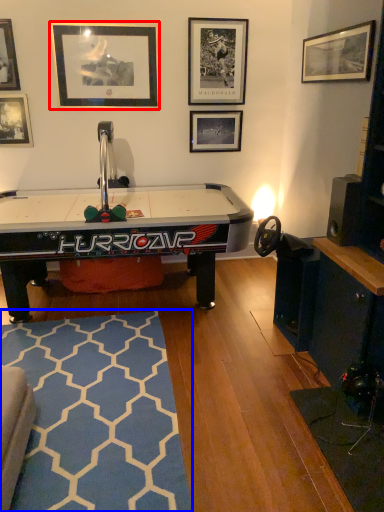
Question: Which of the following is the closest to the observer, picture frame (highlighted by a red box) or mat (highlighted by a blue box)?

Choices:
 (A) picture frame
 (B) mat

Answer: (B)